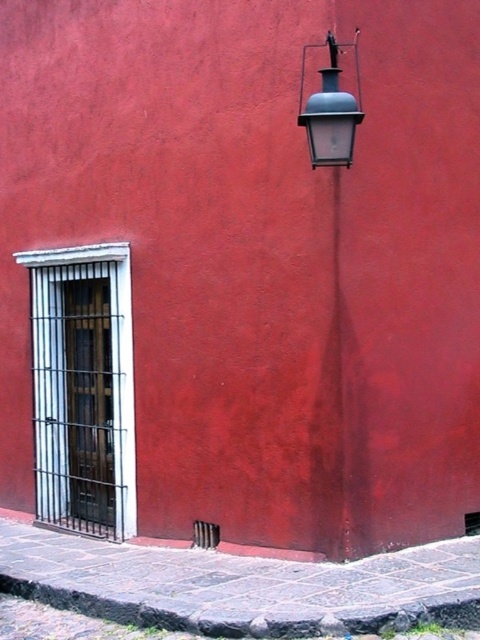
Can you confirm if matte blue glass lamp at upper right is shorter than matte gray lantern at upper right?

Incorrect, matte blue glass lamp at upper right's height does not fall short of matte gray lantern at upper right's.

In the scene shown: Is matte blue glass lamp at upper right closer to the viewer compared to matte gray lantern at upper right?

No, matte blue glass lamp at upper right is further to the viewer.

Between point (336, 115) and point (307, 120), which one is positioned behind?

The point (307, 120) is more distant.

This screenshot has width=480, height=640. What are the coordinates of `matte blue glass lamp at upper right` in the screenshot? It's located at (336, 310).